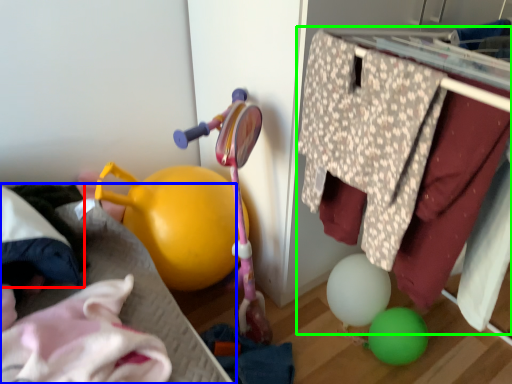
Question: Estimate the real-world distances between objects in this image. Which object is closer to clothing (highlighted by a red box), bed frame (highlighted by a blue box) or closet (highlighted by a green box)?

Choices:
 (A) bed frame
 (B) closet

Answer: (A)